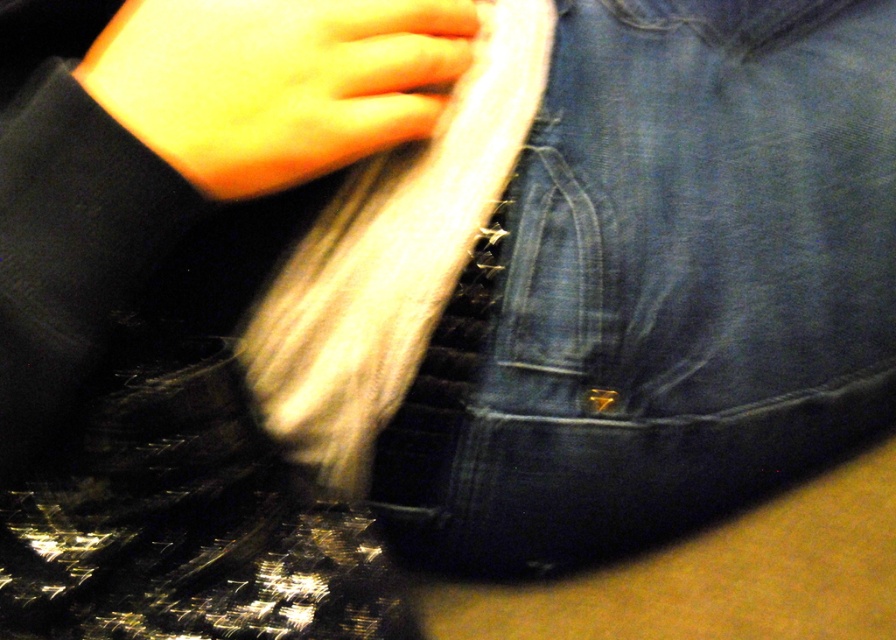
Does point (565, 252) come closer to viewer compared to point (338, 90)?

No, it is behind (338, 90).

This screenshot has width=896, height=640. I want to click on denim at center, so click(661, 289).

Does point (487, 387) come in front of point (121, 104)?

No, (487, 387) is behind (121, 104).

What are the coordinates of `denim at center` in the screenshot? It's located at (661, 289).